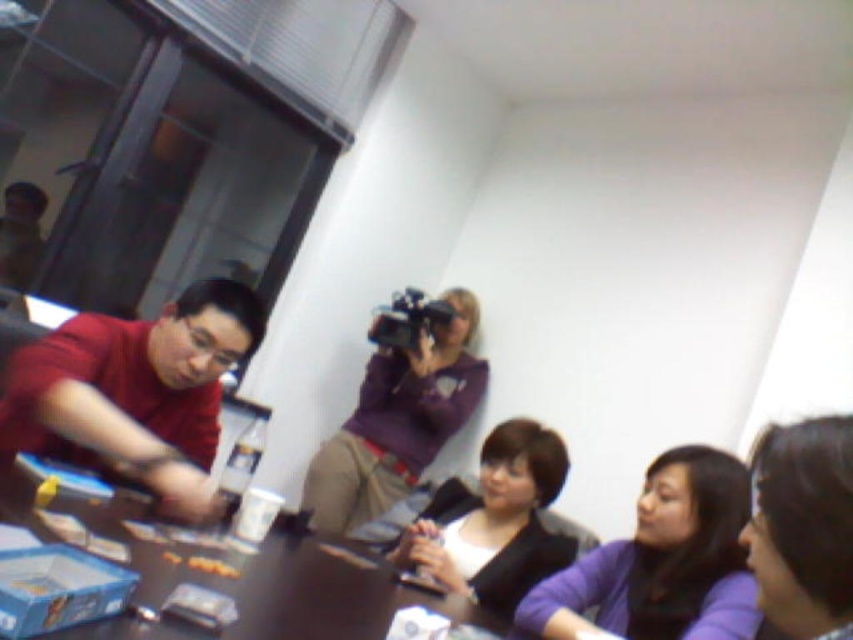
You are standing in the room and want to reach both the point at coordinates (96,348) and the point at coordinates (363,474). Which point should you aim for first to minimize the distance you have to walk?

You should aim for point (96,348) first because it is closer to you than point (363,474).

You are a photographer trying to capture a candid shot of the matte red shirt at left and the smooth purple shirt at lower right. To ensure both shirts are in focus, you need to know which one is taller. Can you tell me which shirt is taller?

The matte red shirt at left is taller than the smooth purple shirt at lower right according to the description.